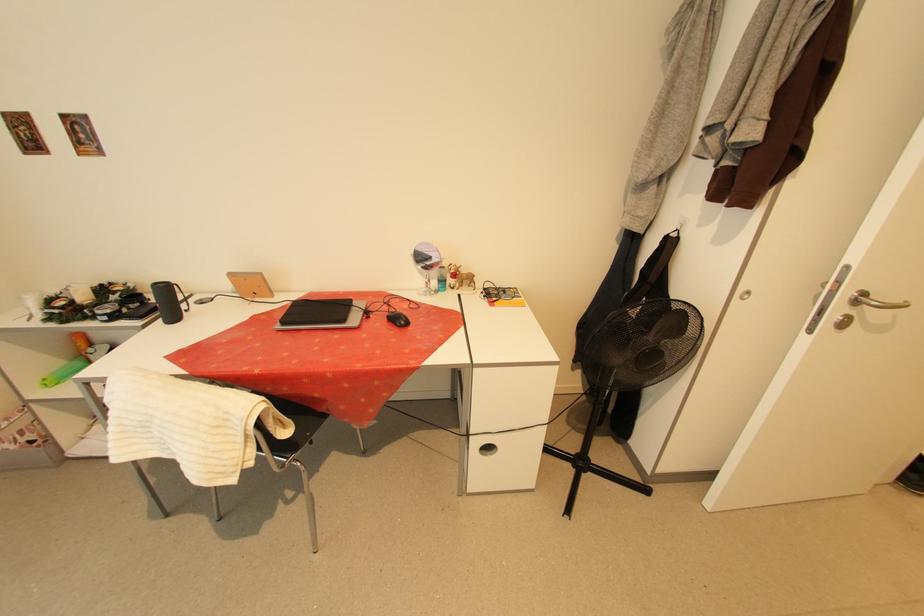
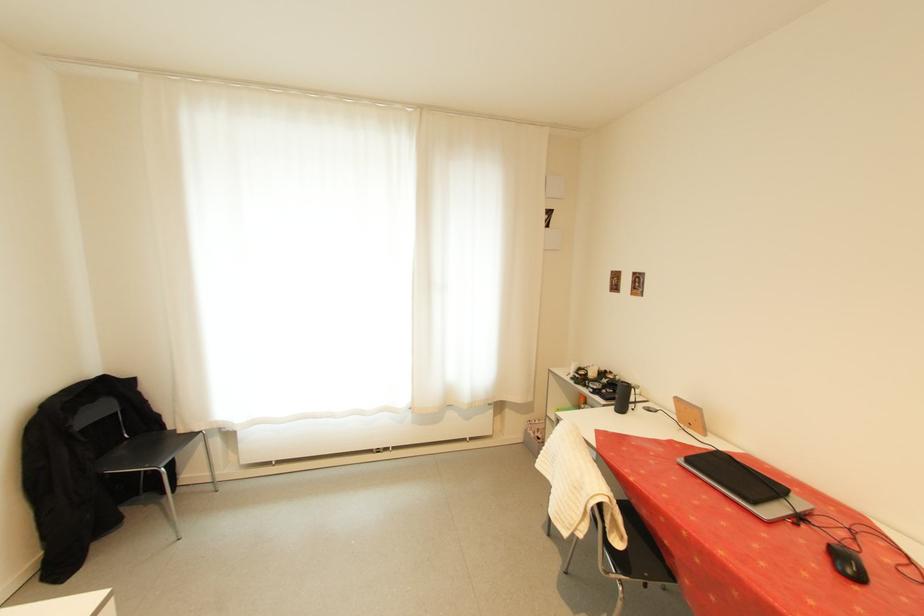
Question: The images are taken continuously from a first-person perspective. In which direction is your viewpoint rotating?

Choices:
 (A) Left
 (B) Right
 (C) Up
 (D) Down

Answer: (A)